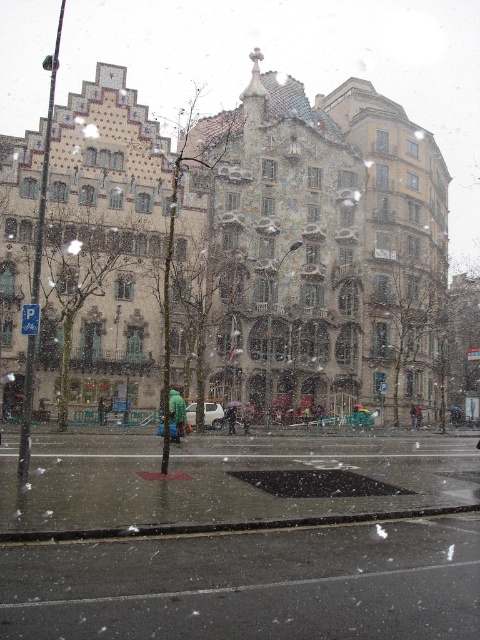
You are standing on the wet street in the snowy scene and see a green fuzzy coat at center and a transparent plastic umbrella at center. Which object is located to the left of the other?

The green fuzzy coat at center is positioned on the left side of transparent plastic umbrella at center.

You are standing in the snowy scene and want to check if your transparent plastic umbrella at center is currently covering your green fuzzy coat at center. Based on the scene, can you confirm if the umbrella is covering the coat?

The green fuzzy coat at center is positioned over transparent plastic umbrella at center, so the umbrella is not covering the coat. The coat is above the umbrella.